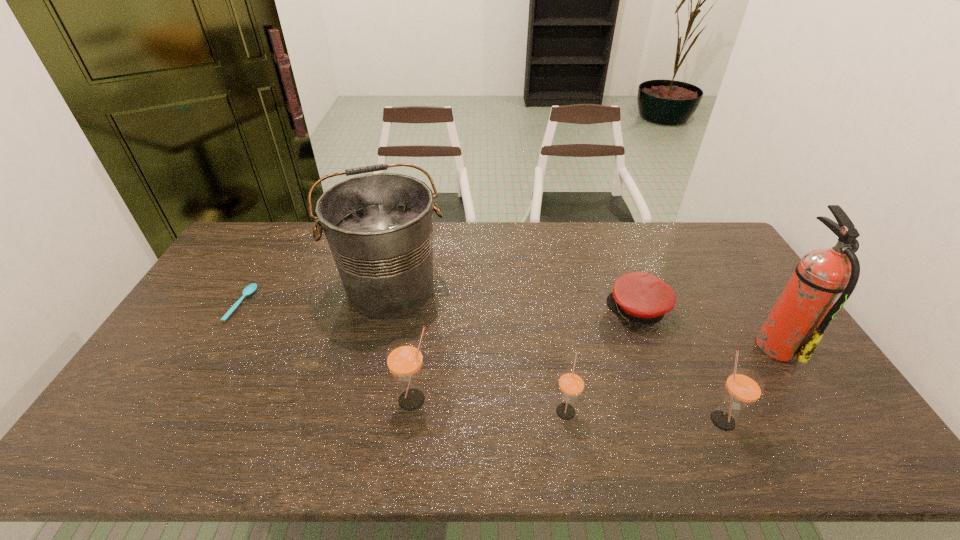
Locate an element on the screen. blank area in the image that satisfies the following two spatial constraints: 1. on the front side of the spoon; 2. on the right side of the second tallest straw is located at coordinates (175, 420).